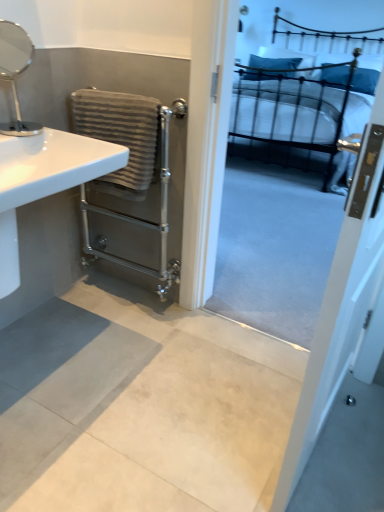
Question: In the image, is gray textured towel at left positioned in front of or behind white glossy sink at left?

Choices:
 (A) front
 (B) behind

Answer: (B)

Question: Is gray textured towel at left inside the boundaries of white glossy sink at left, or outside?

Choices:
 (A) outside
 (B) inside

Answer: (A)

Question: Which is nearer to the white glossy screen door at upper right?

Choices:
 (A) gray textured towel at left
 (B) metallic black bed at upper right
 (C) silver metallic mirror at upper left
 (D) white glossy sink at left

Answer: (D)

Question: Estimate the real-world distances between objects in this image. Which object is closer to the white glossy sink at left?

Choices:
 (A) metallic black bed at upper right
 (B) silver metallic mirror at upper left
 (C) white glossy screen door at upper right
 (D) gray textured towel at left

Answer: (D)